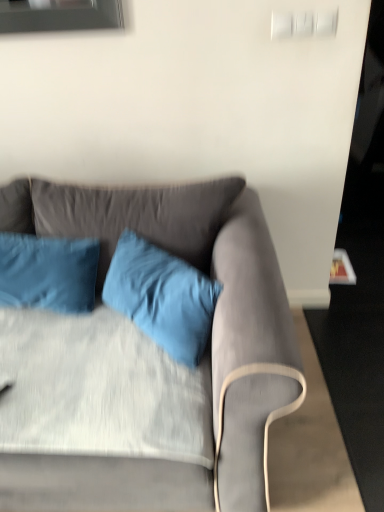
Question: Considering the relative positions of velvet blue pillow at center, which appears as the second pillow when viewed from the left, and matte gray couch at center in the image provided, is velvet blue pillow at center, which appears as the second pillow when viewed from the left, to the left of matte gray couch at center from the viewer's perspective?

Choices:
 (A) yes
 (B) no

Answer: (B)

Question: Can matte gray couch at center be found inside velvet blue pillow at center, which appears as the second pillow when viewed from the left?

Choices:
 (A) no
 (B) yes

Answer: (A)

Question: From a real-world perspective, is velvet blue pillow at center, which appears as the second pillow when viewed from the left, located beneath matte gray couch at center?

Choices:
 (A) no
 (B) yes

Answer: (A)

Question: Does velvet blue pillow at center, the first pillow when ordered from right to left, have a greater height compared to matte gray couch at center?

Choices:
 (A) no
 (B) yes

Answer: (A)

Question: Is velvet blue pillow at center, which appears as the second pillow when viewed from the left, to the right of matte gray couch at center from the viewer's perspective?

Choices:
 (A) no
 (B) yes

Answer: (B)

Question: In terms of height, does matte gray couch at center look taller or shorter compared to velvet blue pillow at center, the first pillow when ordered from right to left?

Choices:
 (A) tall
 (B) short

Answer: (A)

Question: Looking at their shapes, would you say matte gray couch at center is wider or thinner than velvet blue pillow at center, the first pillow when ordered from right to left?

Choices:
 (A) wide
 (B) thin

Answer: (A)

Question: Is matte gray couch at center bigger or smaller than velvet blue pillow at center, which appears as the second pillow when viewed from the left?

Choices:
 (A) big
 (B) small

Answer: (A)

Question: Is matte gray couch at center to the left or to the right of velvet blue pillow at center, which appears as the second pillow when viewed from the left, in the image?

Choices:
 (A) left
 (B) right

Answer: (A)

Question: Based on their positions, is matte gray couch at center located to the left or right of blue satin pillow at left, the 2th pillow positioned from the right?

Choices:
 (A) right
 (B) left

Answer: (A)

Question: Considering the positions of matte gray couch at center and blue satin pillow at left, the 2th pillow positioned from the right, in the image, is matte gray couch at center wider or thinner than blue satin pillow at left, the 2th pillow positioned from the right,?

Choices:
 (A) wide
 (B) thin

Answer: (A)

Question: From their relative heights in the image, would you say matte gray couch at center is taller or shorter than blue satin pillow at left, which ranks as the 1th pillow in left-to-right order?

Choices:
 (A) tall
 (B) short

Answer: (A)

Question: From a real-world perspective, relative to blue satin pillow at left, which ranks as the 1th pillow in left-to-right order, is matte gray couch at center vertically above or below?

Choices:
 (A) above
 (B) below

Answer: (B)

Question: Visually, is velvet blue pillow at center, the first pillow when ordered from right to left, positioned to the left or to the right of matte gray couch at center?

Choices:
 (A) right
 (B) left

Answer: (A)

Question: From their relative heights in the image, would you say velvet blue pillow at center, the first pillow when ordered from right to left, is taller or shorter than matte gray couch at center?

Choices:
 (A) short
 (B) tall

Answer: (A)